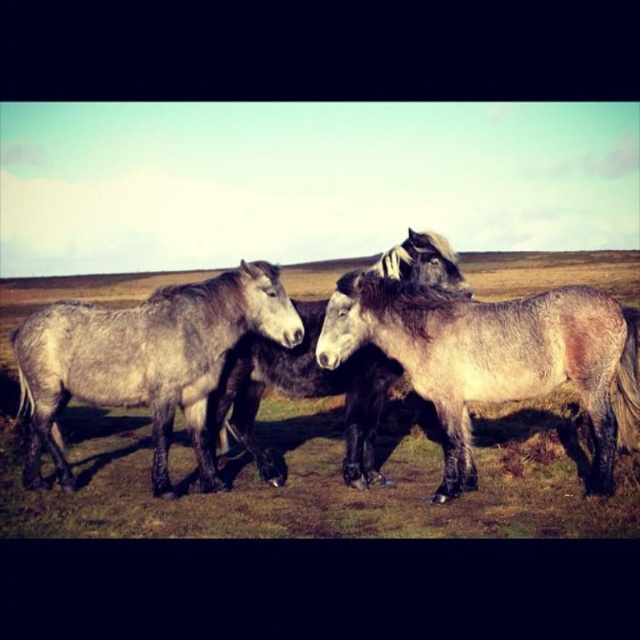
Question: Does gray textured horse at center have a greater width compared to gray matte horse at center?

Choices:
 (A) no
 (B) yes

Answer: (B)

Question: Among these points, which one is nearest to the camera?

Choices:
 (A) (608, 492)
 (B) (44, 314)

Answer: (A)

Question: Can you confirm if gray textured horse at center is positioned to the left of gray matte horse at center?

Choices:
 (A) no
 (B) yes

Answer: (A)

Question: Estimate the real-world distances between objects in this image. Which object is closer to the gray textured horse at center?

Choices:
 (A) gray woolen horse at left
 (B) gray matte horse at center

Answer: (B)

Question: Does gray textured horse at center appear under gray woolen horse at left?

Choices:
 (A) no
 (B) yes

Answer: (B)

Question: Which point appears farthest from the camera in this image?

Choices:
 (A) (68, 394)
 (B) (602, 412)
 (C) (260, 380)

Answer: (C)